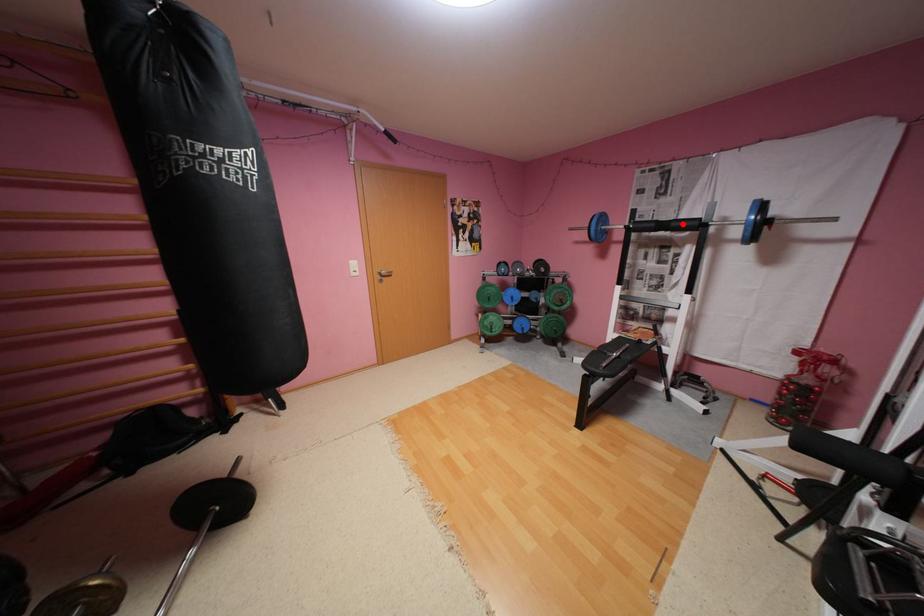
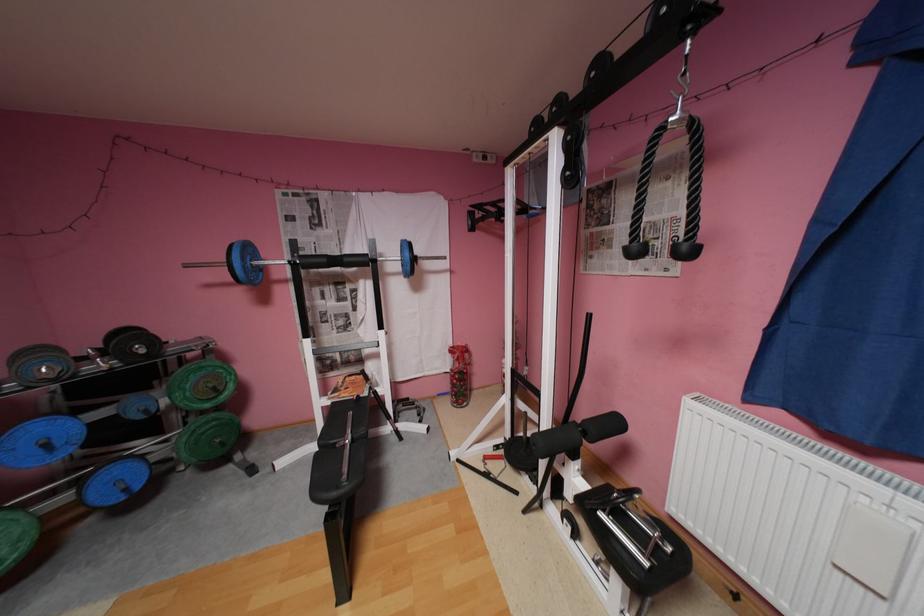
In the second image, find the point that corresponds to the highlighted location in the first image.

(355, 259)